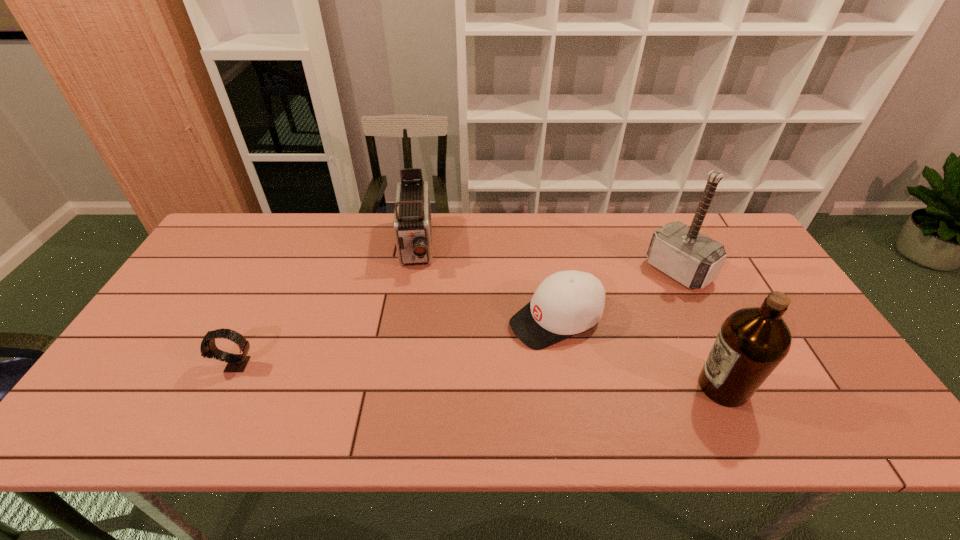
I want to click on vacant space on the desktop that is between the leftmost object and the olive oil and is positioned at the lens of the camcorder, so click(414, 373).

Find the location of `vacant space on the desktop that is between the leftmost object and the olive oil and is positioned for striking with the head of the hammer`. vacant space on the desktop that is between the leftmost object and the olive oil and is positioned for striking with the head of the hammer is located at coordinates (524, 378).

Find the location of a particular element. This screenshot has height=540, width=960. free spot on the desktop that is between the watch and the olive oil and is positioned on the front-facing side of the baseball cap is located at coordinates (428, 374).